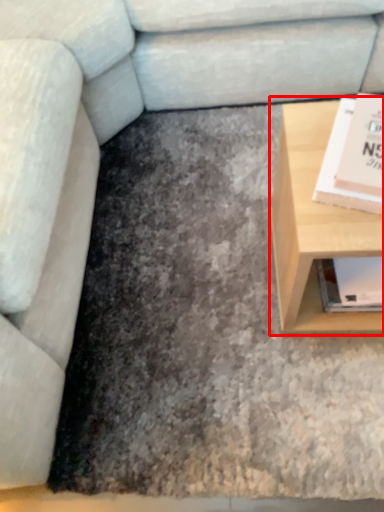
Question: From the image's perspective, where is table (annotated by the red box) located relative to paperback book?

Choices:
 (A) below
 (B) above

Answer: (A)